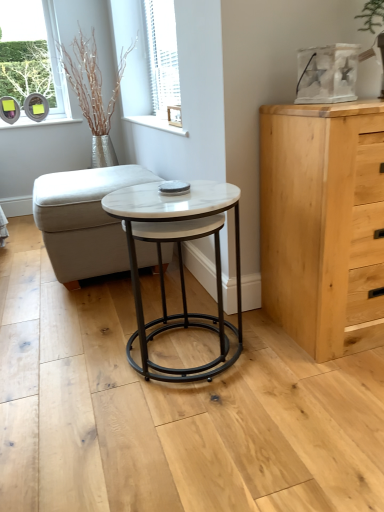
You are a GUI agent. You are given a task and a screenshot of the screen. Output one action in this format:
    pyautogui.click(x=<x>, y=<y>)
    Task: Click on the vacant space in front of white fabric ottoman at center
    
    Given the screenshot: What is the action you would take?
    pyautogui.click(x=63, y=325)